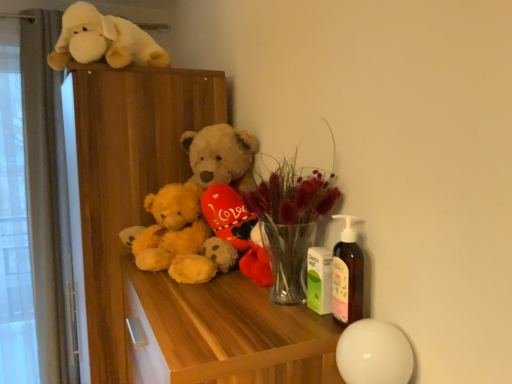
Question: From a real-world perspective, is fluffy yellow teddy bear at center, the first teddy bear viewed from the right, positioned above or below fluffy yellow teddy bear at center, which is counted as the 1th teddy bear, starting from the left?

Choices:
 (A) above
 (B) below

Answer: (A)

Question: From the image's perspective, is fluffy yellow teddy bear at center, the first teddy bear viewed from the right, above or below fluffy yellow teddy bear at center, which is counted as the 1th teddy bear, starting from the left?

Choices:
 (A) above
 (B) below

Answer: (A)

Question: Which object is positioned farthest from the fluffy yellow teddy bear at center, which appears as the 2th teddy bear when viewed from the left?

Choices:
 (A) green matte lotion bottle at center, the 2th toy positioned from the back
 (B) translucent glass vase at center
 (C) white plush dog at upper left, which is the 2th toy from right to left
 (D) fluffy yellow teddy bear at center, which is counted as the 1th teddy bear, starting from the left
 (E) wooden table at center

Answer: (A)

Question: Which object is the farthest from the wooden dresser at upper left?

Choices:
 (A) green matte lotion bottle at center, the 2th toy positioned from the back
 (B) fluffy yellow teddy bear at center, the second teddy bear in the right-to-left sequence
 (C) translucent glass vase at center
 (D) wooden table at center
 (E) fluffy yellow teddy bear at center, the first teddy bear viewed from the right

Answer: (A)